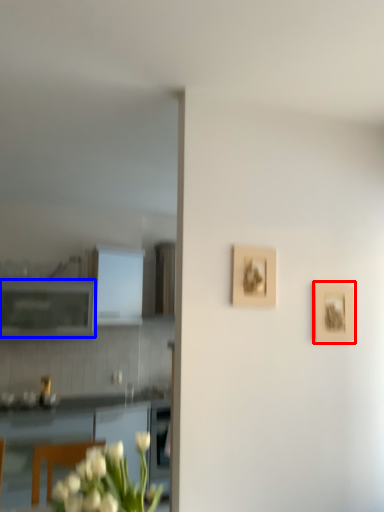
Question: Which point is further to the camera, picture frame (highlighted by a red box) or cabinetry (highlighted by a blue box)?

Choices:
 (A) picture frame
 (B) cabinetry

Answer: (B)